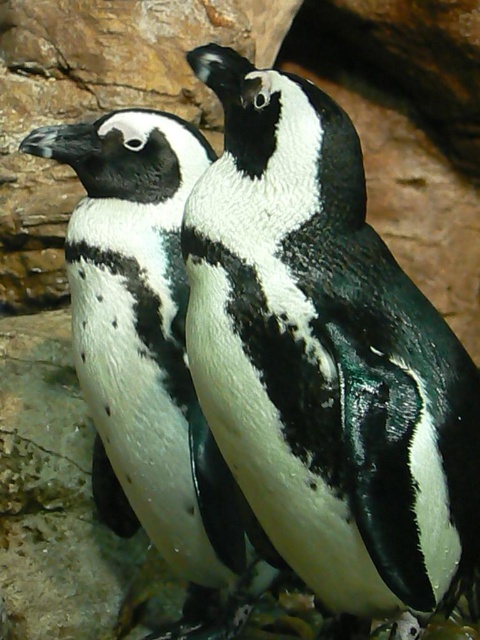
Question: Is the position of black matte penguin at center less distant than that of black and white feathers at center?

Choices:
 (A) yes
 (B) no

Answer: (A)

Question: Can you confirm if black matte penguin at center is thinner than black and white feathers at center?

Choices:
 (A) no
 (B) yes

Answer: (A)

Question: Which object appears closest to the camera in this image?

Choices:
 (A) black matte penguin at center
 (B) black and white feathers at center

Answer: (A)

Question: Which of the following is the closest to the observer?

Choices:
 (A) (93, 179)
 (B) (294, 392)

Answer: (B)

Question: Is black matte penguin at center above black and white feathers at center?

Choices:
 (A) no
 (B) yes

Answer: (B)